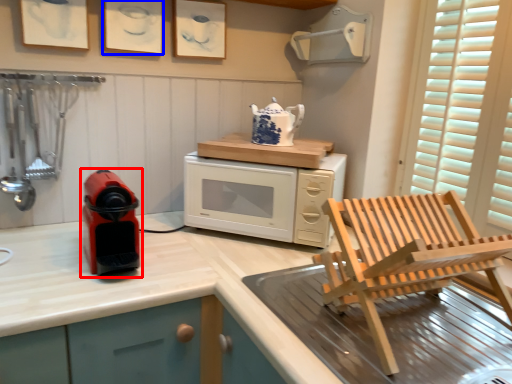
Question: Which object is closer to the camera taking this photo, home appliance (highlighted by a red box) or picture frame (highlighted by a blue box)?

Choices:
 (A) home appliance
 (B) picture frame

Answer: (A)